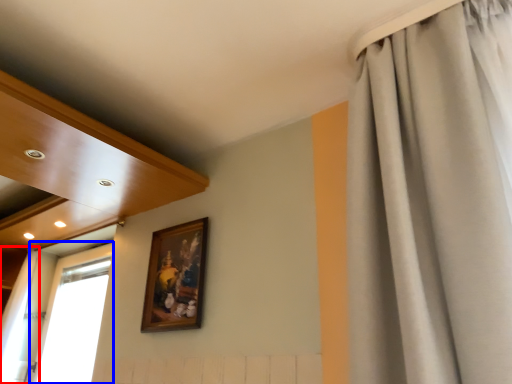
Question: Which of the following is the farthest to the observer, curtain (highlighted by a red box) or window (highlighted by a blue box)?

Choices:
 (A) curtain
 (B) window

Answer: (A)